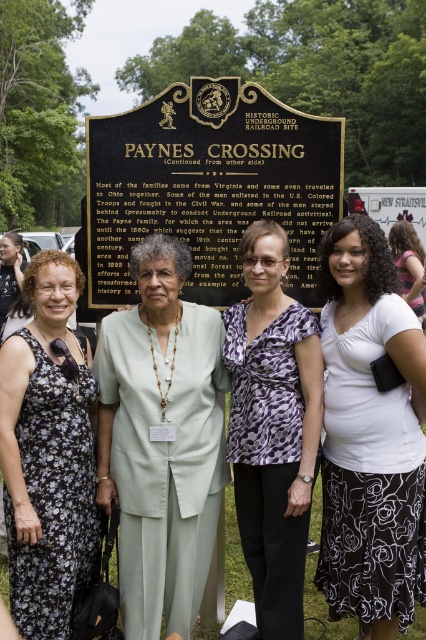
Is gold/bronze plaque at center to the left of pink fabric shirt at center from the viewer's perspective?

Yes, gold/bronze plaque at center is to the left of pink fabric shirt at center.

Does gold/bronze plaque at center lie in front of pink fabric shirt at center?

No, gold/bronze plaque at center is behind pink fabric shirt at center.

Is point (187, 284) closer to viewer compared to point (397, 236)?

Yes, point (187, 284) is in front of point (397, 236).

Locate an element on the screen. This screenshot has width=426, height=640. gold/bronze plaque at center is located at coordinates (209, 186).

The height and width of the screenshot is (640, 426). Find the location of `gold/bronze plaque at center`. gold/bronze plaque at center is located at coordinates (209, 186).

Does white printed fabric skirt at lower right have a larger size compared to floral dress at left?

Actually, white printed fabric skirt at lower right might be smaller than floral dress at left.

Can you confirm if white printed fabric skirt at lower right is shorter than floral dress at left?

Yes.

Who is more forward, (377, 326) or (2, 282)?

Point (377, 326)

Find the location of a particular element. white printed fabric skirt at lower right is located at coordinates (368, 435).